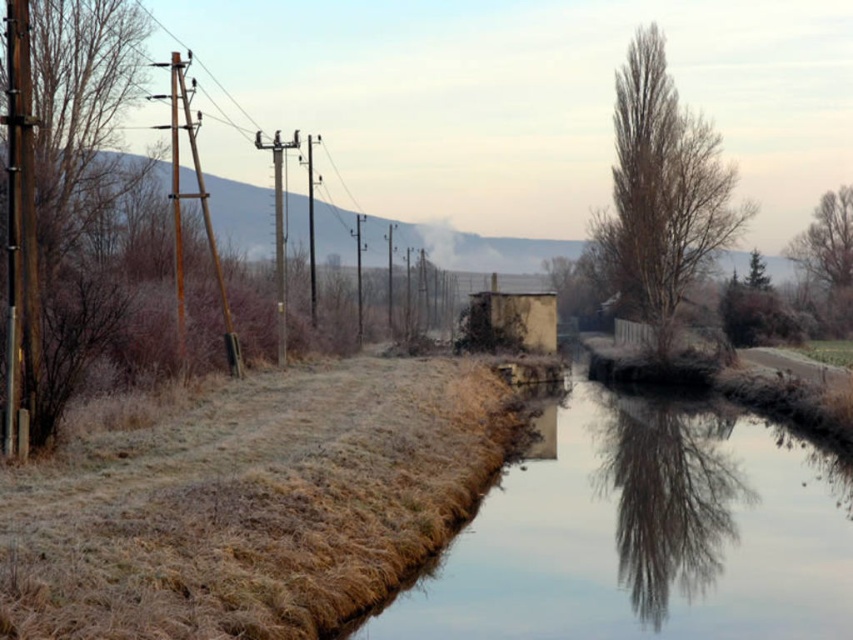
Does bare brown tree at upper right appear on the left side of bare branches at upper right?

Correct, you'll find bare brown tree at upper right to the left of bare branches at upper right.

Between bare brown tree at upper right and bare branches at upper right, which one appears on the left side from the viewer's perspective?

From the viewer's perspective, bare brown tree at upper right appears more on the left side.

Is point (630, 120) positioned after point (833, 323)?

No, (630, 120) is closer to viewer.

I want to click on bare brown tree at upper right, so click(x=660, y=193).

Looking at this image, who is positioned more to the left, brown wooden pole at left or bare branches at upper right?

brown wooden pole at left

Which is above, brown wooden pole at left or bare branches at upper right?

bare branches at upper right is above.

Between point (13, 422) and point (851, 186), which one is positioned in front?

Positioned in front is point (13, 422).

Image resolution: width=853 pixels, height=640 pixels. What are the coordinates of `brown wooden pole at left` in the screenshot? It's located at (19, 228).

Does bare brown tree at upper right have a lesser width compared to brown wooden pole at left?

No.

Does point (653, 198) come farther from viewer compared to point (16, 394)?

Yes, it is.

Where is `bare brown tree at upper right`? The image size is (853, 640). bare brown tree at upper right is located at coordinates (660, 193).